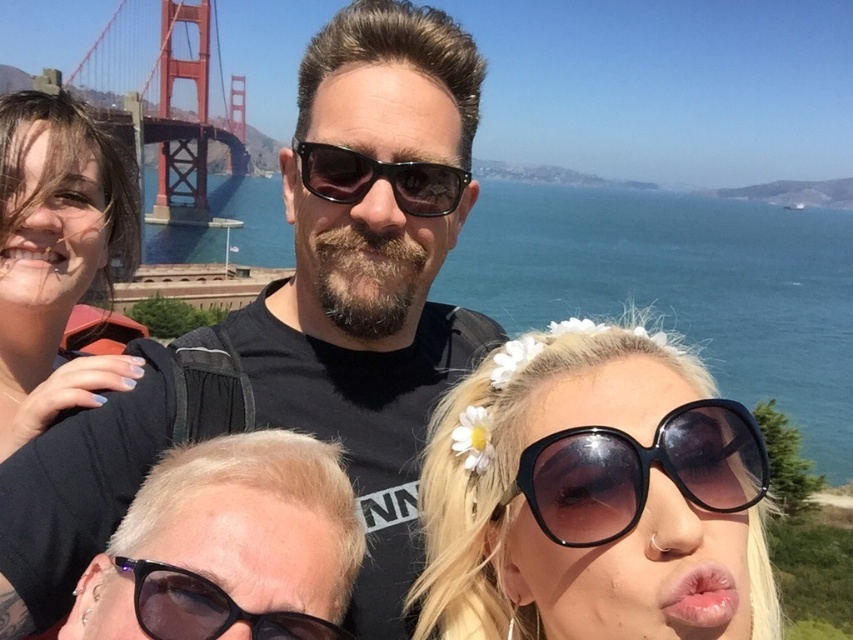
You are a photographer trying to capture a group photo. You notice two people in the group have different hair colors and styles. Which person has thinner hair between the blonde hair at center and the matte black hair at left?

The blonde hair at center is thinner than the matte black hair at left.

You are a photographer trying to capture a closeup shot of the man in the center. You notice the blonde hair at center and the black plastic sunglasses at center. Which object should you focus on first if you want to ensure both are in focus?

The blonde hair at center is wider than the black plastic sunglasses at center, so focusing on the wider object first will help ensure both are in focus.

You are a photographer trying to capture a closeup of the black matte sunglasses at center and the blonde hair at center. Which object is closer to the camera?

The black matte sunglasses at center is closer to the camera than the blonde hair at center.